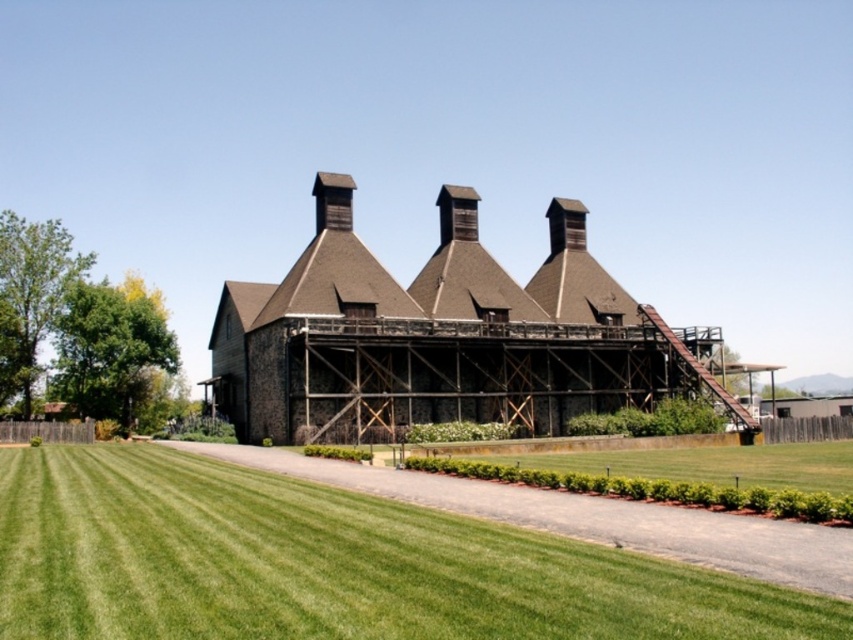
Is green grass at lower left smaller than brown wooden building at center?

Correct, green grass at lower left occupies less space than brown wooden building at center.

Looking at this image, can you confirm if green grass at lower left is positioned to the left of brown wooden building at center?

Indeed, green grass at lower left is positioned on the left side of brown wooden building at center.

Does point (125, 593) come farther from viewer compared to point (422, 365)?

No, (125, 593) is in front of (422, 365).

This screenshot has width=853, height=640. What are the coordinates of `green grass at lower left` in the screenshot? It's located at (329, 564).